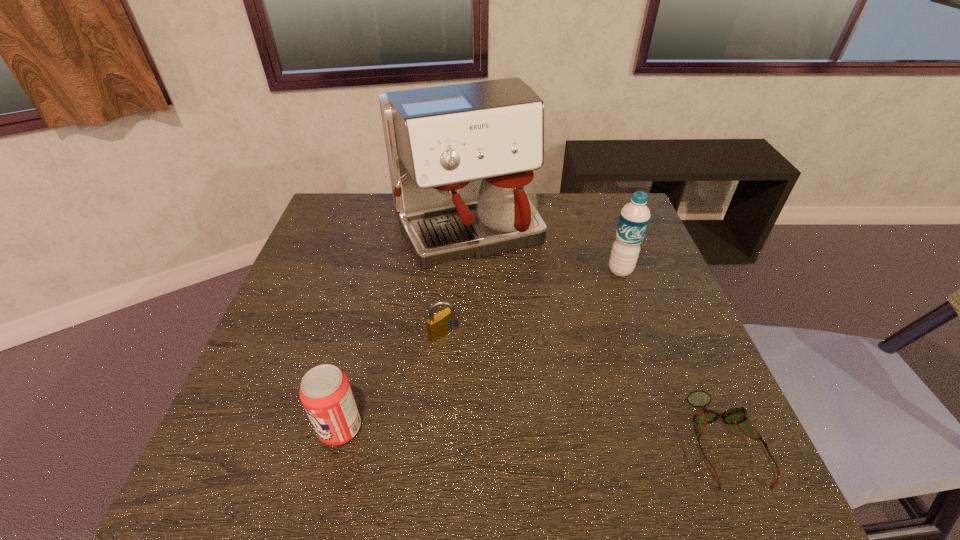
Find the location of a particular element. Image resolution: width=960 pixels, height=540 pixels. soda can is located at coordinates (325, 392).

Locate an element on the screen. spectacles is located at coordinates (739, 416).

Locate an element on the screen. This screenshot has height=540, width=960. water bottle is located at coordinates (634, 217).

Identify the location of the third farthest object. Image resolution: width=960 pixels, height=540 pixels. (438, 325).

You are a GUI agent. You are given a task and a screenshot of the screen. Output one action in this format:
    pyautogui.click(x=<x>, y=<y>)
    Task: Click on the fourth tallest object
    
    Given the screenshot: What is the action you would take?
    pyautogui.click(x=438, y=325)

I want to click on the tallest object, so click(461, 157).

Identify the location of free spot located on the surface of the soda can. The height and width of the screenshot is (540, 960). (231, 428).

Find the location of a particular element. This screenshot has width=960, height=540. free space located 0.100m on the surface of the soda can is located at coordinates coord(267,428).

Find the location of a particular element. This screenshot has height=540, width=960. free space located on the surface of the soda can is located at coordinates (231, 428).

This screenshot has width=960, height=540. I want to click on free spot located 0.220m on the label of the water bottle, so click(x=596, y=335).